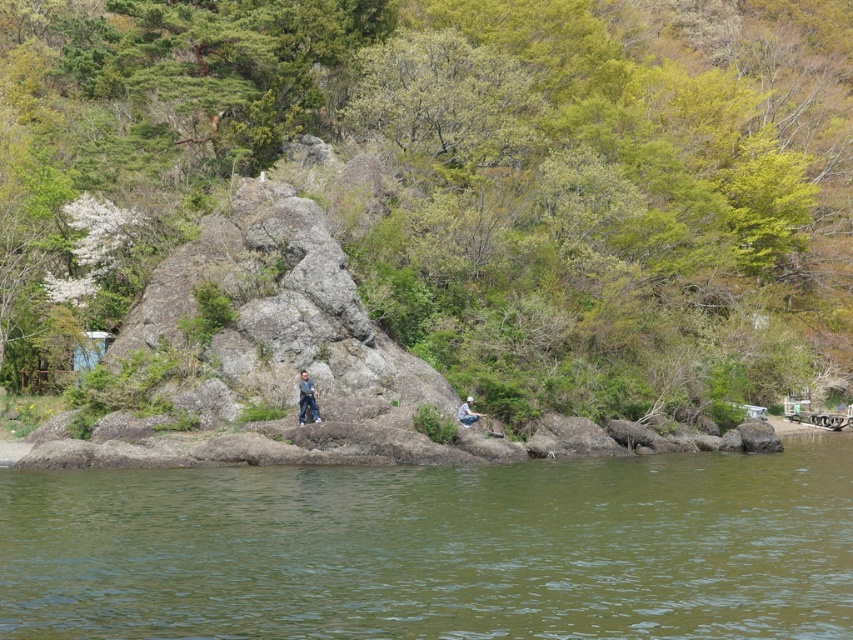
Is green leafy tree at upper center below light gray stone person at center?

No.

Is point (827, 330) less distant than point (463, 403)?

No.

This screenshot has width=853, height=640. Identify the location of green leafy tree at upper center. (457, 180).

Is denim pants at center wider than light gray stone person at center?

Incorrect, denim pants at center's width does not surpass light gray stone person at center's.

Find the location of `denim pants at center`. denim pants at center is located at coordinates (306, 397).

Who is more forward, [302,408] or [459,406]?

Positioned in front is point [302,408].

Where is `denim pants at center`? denim pants at center is located at coordinates (306, 397).

Which is below, green leafy tree at upper center or denim pants at center?

denim pants at center is lower down.

Is green leafy tree at upper center below denim pants at center?

No.

Between point (247, 131) and point (305, 371), which one is positioned in front?

Point (305, 371) is in front.

The image size is (853, 640). I want to click on green leafy tree at upper center, so click(457, 180).